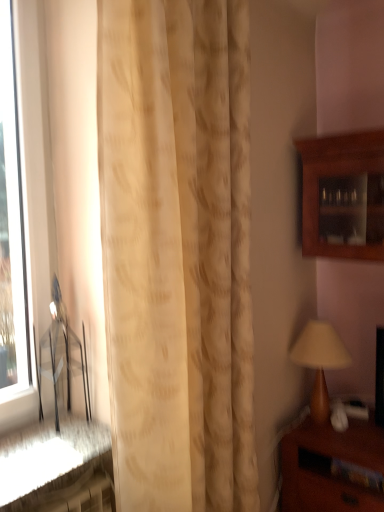
Measure the distance between point [115,42] and camera.

Point [115,42] is 1.10 meters from camera.

Image resolution: width=384 pixels, height=512 pixels. What do you see at coordinates (343, 194) in the screenshot? I see `wooden cabinet at upper right` at bounding box center [343, 194].

At what (x,y) coordinates should I click in order to perform the action: click on brown wooden nightstand at lower right. Please return your answer as a coordinate pair (x, y). This screenshot has width=384, height=512. Looking at the image, I should click on (330, 467).

Describe the element at coordinates (320, 362) in the screenshot. I see `matte brown table lamp at right` at that location.

Locate an element on the screen. The width and height of the screenshot is (384, 512). beige textured curtain at center is located at coordinates 177,252.

Which point is more forward, (237, 63) or (319, 330)?

The point (237, 63) is closer.

You are a GUI agent. You are given a task and a screenshot of the screen. Output one action in this format:
    pyautogui.click(x=<x>, y=<y>)
    Task: Click on the curtain that appears above the matte brown table lamp at right (from a real-world perspective)
    Image resolution: width=384 pixels, height=512 pixels.
    Given the screenshot: What is the action you would take?
    pyautogui.click(x=177, y=252)

From the picture: Which of these two, beige textured curtain at center or matte brown table lamp at right, stands taller?

beige textured curtain at center.

Would you say beige textured curtain at center contains matte brown table lamp at right?

No, matte brown table lamp at right is not surrounded by beige textured curtain at center.

Considering the sizes of objects metallic silver chair at left and matte brown table lamp at right in the image provided, who is taller, metallic silver chair at left or matte brown table lamp at right?

metallic silver chair at left is taller.

From the picture: Between metallic silver chair at left and matte brown table lamp at right, which one has smaller width?

metallic silver chair at left.

Between metallic silver chair at left and matte brown table lamp at right, which one appears on the left side from the viewer's perspective?

metallic silver chair at left.

Identify the location of chair above the matte brown table lamp at right (from a real-world perspective). Image resolution: width=384 pixels, height=512 pixels. (61, 351).

Which is more to the right, beige textured curtain at center or wooden cabinet at upper right?

From the viewer's perspective, wooden cabinet at upper right appears more on the right side.

Is point (233, 62) behind point (313, 175)?

No, it is in front of (313, 175).

From the image's perspective, is beige textured curtain at center located beneath wooden cabinet at upper right?

Yes, from the image's perspective, beige textured curtain at center is beneath wooden cabinet at upper right.

Is the depth of beige textured curtain at center less than that of wooden cabinet at upper right?

Yes, beige textured curtain at center is closer to the camera.

Is wooden cabinet at upper right taller than brown wooden nightstand at lower right?

Yes.

Who is smaller, wooden cabinet at upper right or brown wooden nightstand at lower right?

Smaller between the two is wooden cabinet at upper right.

Is wooden cabinet at upper right thinner than brown wooden nightstand at lower right?

Yes, wooden cabinet at upper right is thinner than brown wooden nightstand at lower right.

Is wooden cabinet at upper right turned away from brown wooden nightstand at lower right?

No, wooden cabinet at upper right is not facing away from brown wooden nightstand at lower right.

From a real-world perspective, which is physically below, metallic silver chair at left or wooden cabinet at upper right?

metallic silver chair at left is physically lower.

You are a GUI agent. You are given a task and a screenshot of the screen. Output one action in this format:
    pyautogui.click(x=<x>, y=<y>)
    Task: Click on the chair lying below the wooden cabinet at upper right (from the image's perspective)
    
    Given the screenshot: What is the action you would take?
    pyautogui.click(x=61, y=351)

Is metallic silver chair at left smaller than wooden cabinet at upper right?

Yes.

How far apart are metallic silver chair at left and wooden cabinet at upper right?

metallic silver chair at left and wooden cabinet at upper right are 1.39 meters apart from each other.

From a real-world perspective, who is located lower, matte brown table lamp at right or metallic silver chair at left?

In real-world perspective, matte brown table lamp at right is lower.

Considering the sizes of matte brown table lamp at right and metallic silver chair at left in the image, is matte brown table lamp at right taller or shorter than metallic silver chair at left?

In the image, matte brown table lamp at right appears to be shorter than metallic silver chair at left.

Considering the sizes of matte brown table lamp at right and metallic silver chair at left in the image, is matte brown table lamp at right wider or thinner than metallic silver chair at left?

In the image, matte brown table lamp at right appears to be wider than metallic silver chair at left.

Are matte brown table lamp at right and metallic silver chair at left located far from each other?

Yes, matte brown table lamp at right and metallic silver chair at left are quite far apart.

Would you say metallic silver chair at left is outside beige textured curtain at center?

Yes, metallic silver chair at left is located beyond the bounds of beige textured curtain at center.

From the image's perspective, does metallic silver chair at left appear higher than beige textured curtain at center?

No, from the image's perspective, metallic silver chair at left is not above beige textured curtain at center.

From the picture: Does metallic silver chair at left have a greater width compared to beige textured curtain at center?

No, metallic silver chair at left is not wider than beige textured curtain at center.

Can you confirm if metallic silver chair at left is bigger than beige textured curtain at center?

Incorrect, metallic silver chair at left is not larger than beige textured curtain at center.

You are a GUI agent. You are given a task and a screenshot of the screen. Output one action in this format:
    pyautogui.click(x=<x>, y=<y>)
    Task: Click on the table lamp that appears on the right of beige textured curtain at center
    
    Given the screenshot: What is the action you would take?
    pyautogui.click(x=320, y=362)

Locate an element on the screen. table lamp below the metallic silver chair at left (from the image's perspective) is located at coordinates (320, 362).

Considering their positions, is wooden cabinet at upper right positioned further to metallic silver chair at left than beige textured curtain at center?

wooden cabinet at upper right is positioned further to the anchor metallic silver chair at left.

Estimate the real-world distances between objects in this image. Which object is closer to metallic silver chair at left, matte brown table lamp at right or wooden cabinet at upper right?

matte brown table lamp at right is positioned closer to the anchor metallic silver chair at left.

Which object lies further to the anchor point metallic silver chair at left, brown wooden nightstand at lower right or matte brown table lamp at right?

Based on the image, brown wooden nightstand at lower right appears to be further to metallic silver chair at left.

Which object lies further to the anchor point metallic silver chair at left, transparent glass window at left or wooden cabinet at upper right?

wooden cabinet at upper right is positioned further to the anchor metallic silver chair at left.

Looking at the image, which one is located closer to beige textured curtain at center, brown wooden nightstand at lower right or transparent glass window at left?

transparent glass window at left is closer to beige textured curtain at center.

From the image, which object appears to be nearer to transparent glass window at left, metallic silver chair at left or beige textured curtain at center?

Among the two, metallic silver chair at left is located nearer to transparent glass window at left.

Looking at the image, which one is located closer to wooden cabinet at upper right, brown wooden nightstand at lower right or metallic silver chair at left?

Among the two, brown wooden nightstand at lower right is located nearer to wooden cabinet at upper right.

Based on their spatial positions, is wooden cabinet at upper right or matte brown table lamp at right further from brown wooden nightstand at lower right?

Based on the image, wooden cabinet at upper right appears to be further to brown wooden nightstand at lower right.

I want to click on chair between transparent glass window at left and matte brown table lamp at right from left to right, so click(x=61, y=351).

Identify the location of curtain located between transparent glass window at left and wooden cabinet at upper right in the left-right direction. (177, 252).

Where is `table lamp located between transparent glass window at left and wooden cabinet at upper right in the left-right direction`? This screenshot has width=384, height=512. table lamp located between transparent glass window at left and wooden cabinet at upper right in the left-right direction is located at coordinates (320, 362).

Find the location of a particular element. Image resolution: width=384 pixels, height=512 pixels. table lamp between transparent glass window at left and brown wooden nightstand at lower right from left to right is located at coordinates (320, 362).